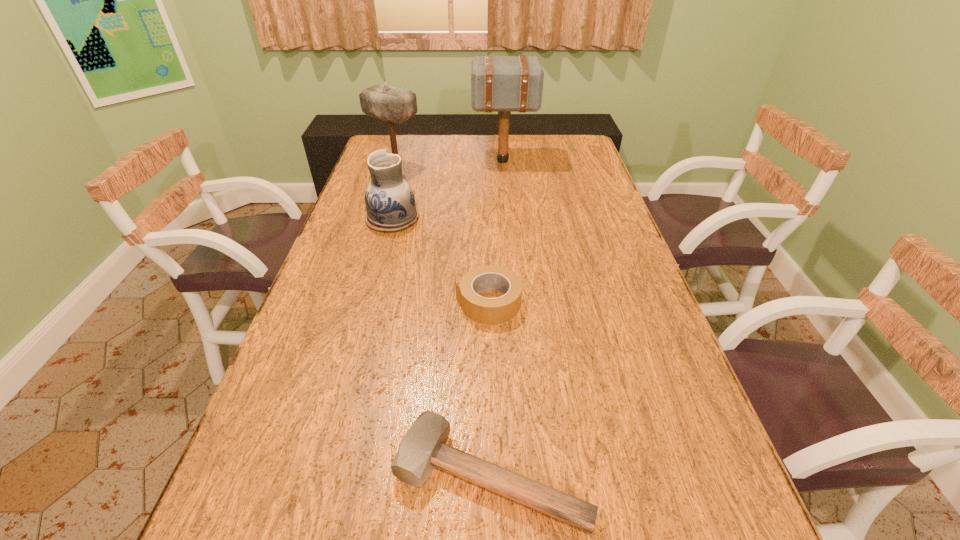
At what (x,y) coordinates should I click in order to perform the action: click on free spot between the duct tape and the pottery. Please return your answer as a coordinate pair (x, y). Looking at the image, I should click on (441, 261).

Locate an element on the screen. empty space that is in between the third nearest object and the nearest object is located at coordinates (442, 348).

Locate which object ranks in proximity to the nearest mallet. Please provide its 2D coordinates. Your answer should be formatted as a tuple, i.e. [(x, y)], where the tuple contains the x and y coordinates of a point satisfying the conditions above.

[(484, 310)]

Locate an element on the screen. The image size is (960, 540). object that stands as the closest to the duct tape is located at coordinates (390, 203).

The width and height of the screenshot is (960, 540). Find the location of `mallet that stands as the closest to the leftmost mallet`. mallet that stands as the closest to the leftmost mallet is located at coordinates pos(504,84).

Locate which mallet is the closest to the leftmost mallet. Please provide its 2D coordinates. Your answer should be formatted as a tuple, i.e. [(x, y)], where the tuple contains the x and y coordinates of a point satisfying the conditions above.

[(504, 84)]

Where is `free space that satisfies the following two spatial constraints: 1. on the front side of the pottery; 2. on the right side of the shortest mallet`? free space that satisfies the following two spatial constraints: 1. on the front side of the pottery; 2. on the right side of the shortest mallet is located at coordinates (324, 476).